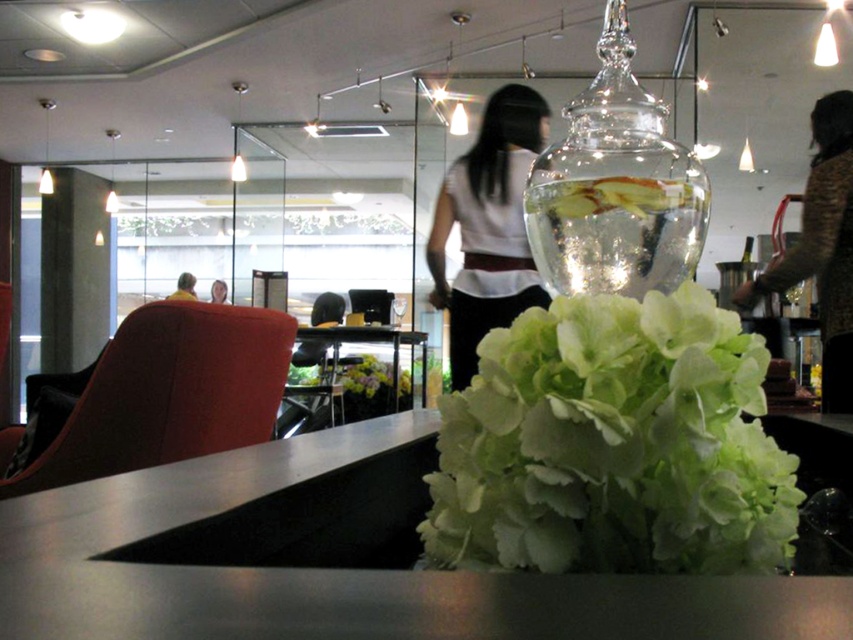
You are a visitor entering the room and see the transparent glass fishbowl at upper center and the smooth yellow shirt at center. Which object is closer to the ceiling?

The transparent glass fishbowl at upper center is located below the smooth yellow shirt at center, so the smooth yellow shirt at center is closer to the ceiling.

You are standing in the lounge and want to place a small potted plant between the transparent glass fishbowl at upper center and the smooth yellow shirt at center. Based on their positions, where should you position the plant?

The transparent glass fishbowl at upper center is to the right of the smooth yellow shirt at center, so you should place the plant between them to the left of the fishbowl and right of the shirt.